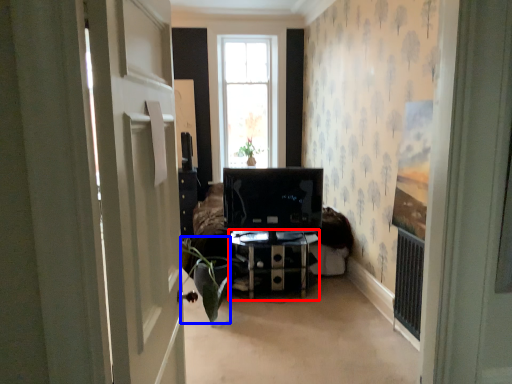
Question: Which of the following is the closest to the observer, furniture (highlighted by a red box) or plant (highlighted by a blue box)?

Choices:
 (A) furniture
 (B) plant

Answer: (B)